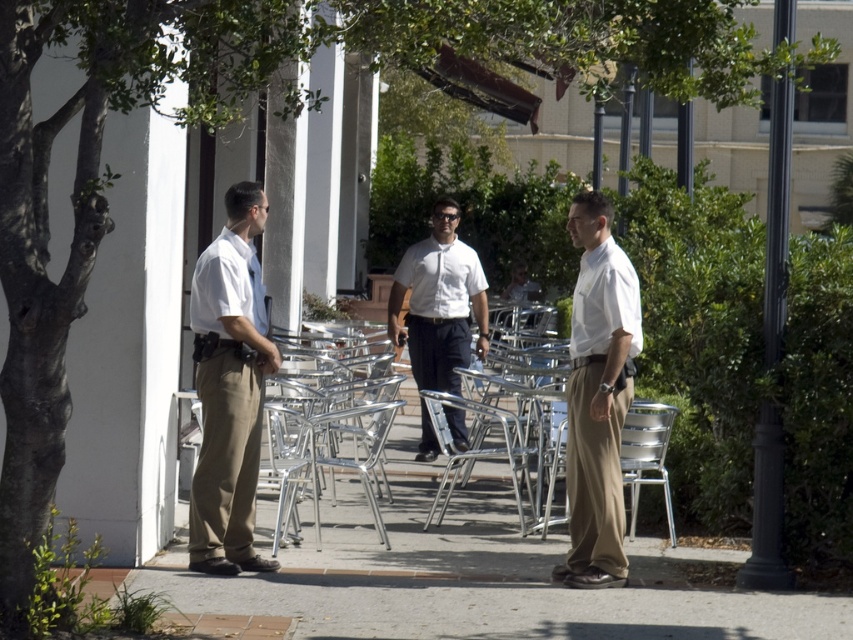
Describe the element at coordinates (473, 577) in the screenshot. I see `smooth concrete pavement at center` at that location.

Who is positioned more to the left, smooth concrete pavement at center or metallic silver chair at center?

From the viewer's perspective, smooth concrete pavement at center appears more on the left side.

In order to click on smooth concrete pavement at center in this screenshot , I will do `click(473, 577)`.

Find the location of a particular element. This screenshot has height=640, width=853. smooth concrete pavement at center is located at coordinates (473, 577).

Looking at this image, between matte khaki pants at center and white shirt at center, which one appears on the right side from the viewer's perspective?

Positioned to the right is matte khaki pants at center.

Who is more forward, (589,397) or (392,292)?

Point (589,397)

The width and height of the screenshot is (853, 640). What do you see at coordinates (596, 396) in the screenshot? I see `matte khaki pants at center` at bounding box center [596, 396].

At what (x,y) coordinates should I click in order to perform the action: click on matte khaki pants at center. Please return your answer as a coordinate pair (x, y). Looking at the image, I should click on (596, 396).

Who is lower down, matte khaki pants at left or metallic silver chair at center?

metallic silver chair at center is lower down.

Is matte khaki pants at left smaller than metallic silver chair at center?

Yes, matte khaki pants at left is smaller than metallic silver chair at center.

Is point (234, 259) closer to camera compared to point (474, 424)?

Yes, point (234, 259) is closer to viewer.

The width and height of the screenshot is (853, 640). I want to click on matte khaki pants at left, so click(229, 387).